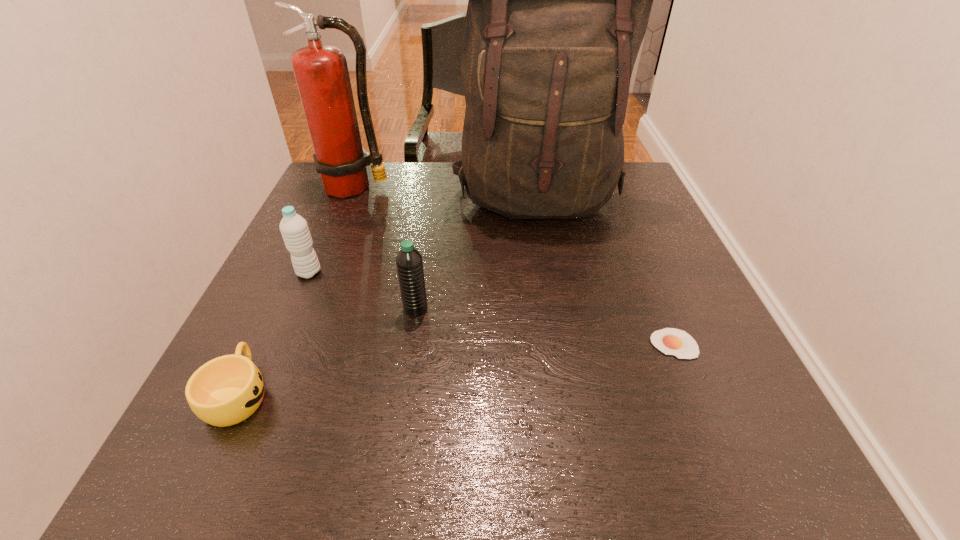
The image size is (960, 540). What are the coordinates of `blank space located 0.240m on the open flap of the backpack` in the screenshot? It's located at (557, 307).

Locate an element on the screen. This screenshot has width=960, height=540. free space located 0.270m at the nozzle of the fire extinguisher is located at coordinates (323, 267).

Locate an element on the screen. vacant area situated on the back of the fourth nearest object is located at coordinates (329, 226).

I want to click on blank space located 0.360m on the back of the nearer water bottle, so click(431, 204).

Identify the location of vacant space situated 0.360m on the right of the second shortest object. (486, 394).

Where is `vacant area situated 0.070m on the back of the shortest object`? This screenshot has height=540, width=960. vacant area situated 0.070m on the back of the shortest object is located at coordinates (657, 303).

Find the location of a particular element. Image resolution: width=960 pixels, height=540 pixels. backpack positioned at the far edge is located at coordinates (559, 0).

Where is `fire extinguisher present at the far edge`? The width and height of the screenshot is (960, 540). fire extinguisher present at the far edge is located at coordinates (321, 72).

What are the coordinates of `object present at the near edge` in the screenshot? It's located at (226, 390).

The height and width of the screenshot is (540, 960). I want to click on fire extinguisher at the left edge, so click(321, 72).